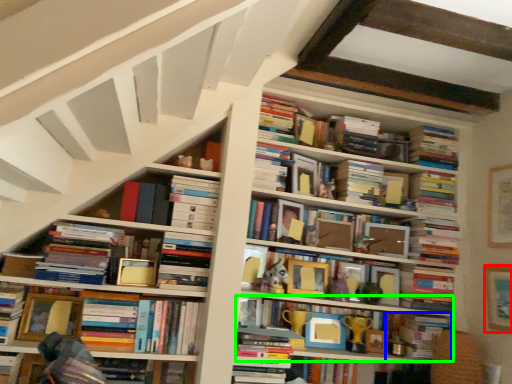
Question: Which is nearer to the picture frame (highlighted by a red box)? book (highlighted by a blue box) or book (highlighted by a green box).

Choices:
 (A) book
 (B) book

Answer: (A)